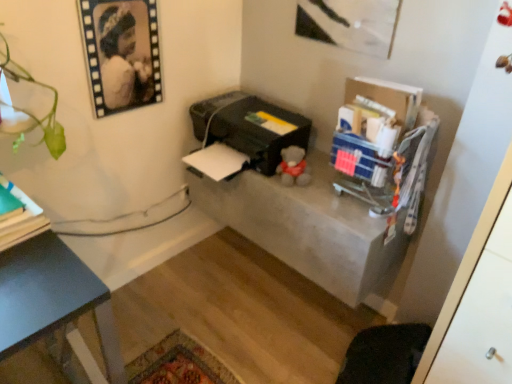
Image resolution: width=512 pixels, height=384 pixels. In order to click on vacant location below black plastic printer at center (from a real-world perspective) in this screenshot , I will do `click(230, 271)`.